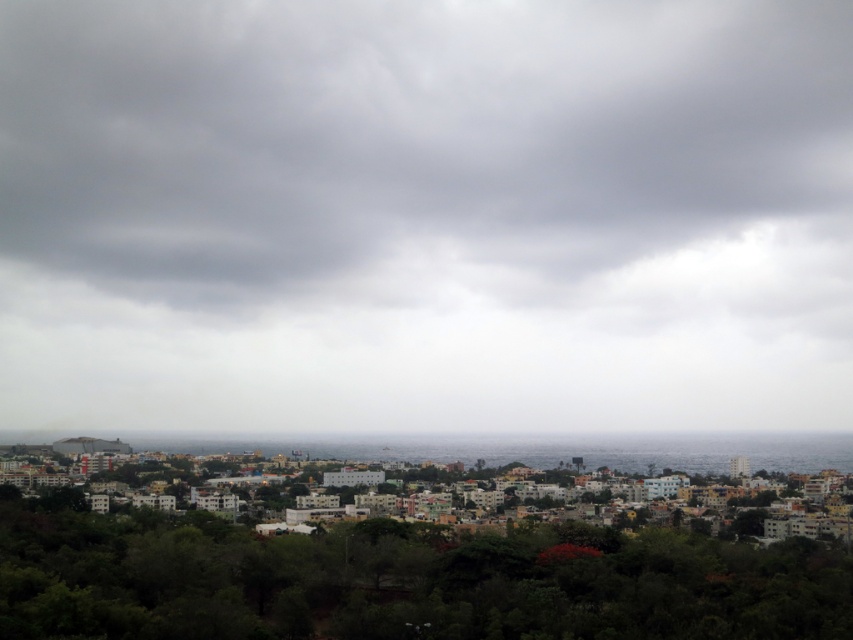
You are standing in the city and looking at the gray cloudy sky at upper center and the green leafy trees at lower center. Which object is positioned to the left of the other?

The gray cloudy sky at upper center is positioned to the left of the green leafy trees at lower center.

You are standing in the cityscape scene and want to walk from your current position to the point at coordinates point (218, 582). However, there is an obstacle at point (401, 355). Based on the spatial relationship between these two points, will you encounter the obstacle before reaching your destination?

Yes, you will encounter the obstacle at point (401, 355) before reaching the destination at point (218, 582) because point (401, 355) is in front of point (218, 582).